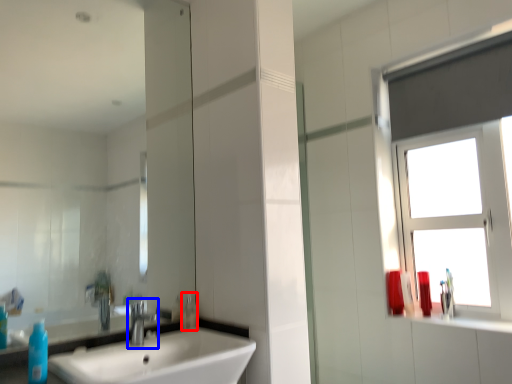
Question: Which object is closer to the camera taking this photo, toiletry (highlighted by a red box) or tap (highlighted by a blue box)?

Choices:
 (A) toiletry
 (B) tap

Answer: (B)